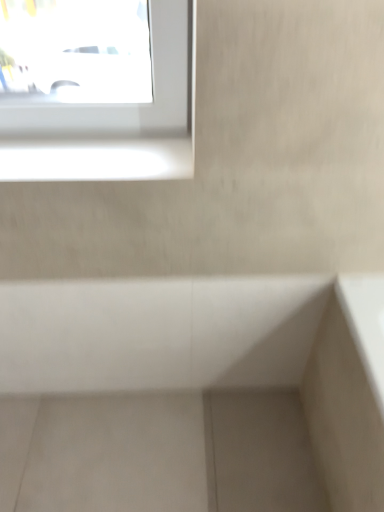
Describe the element at coordinates (117, 454) in the screenshot. I see `smooth concrete floor at lower center` at that location.

Identify the location of smooth concrete floor at lower center. (117, 454).

This screenshot has width=384, height=512. What are the coordinates of `smooth concrete floor at lower center` in the screenshot? It's located at (117, 454).